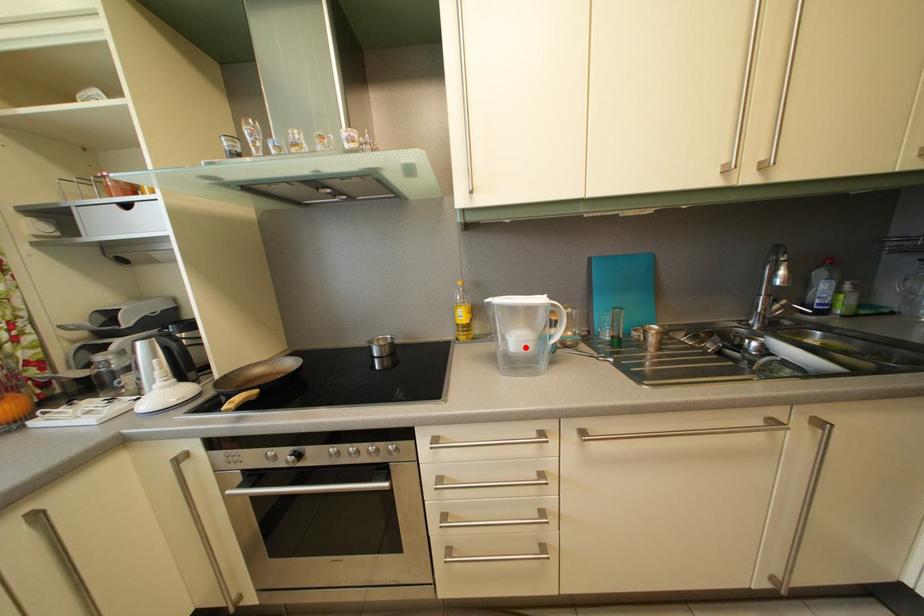
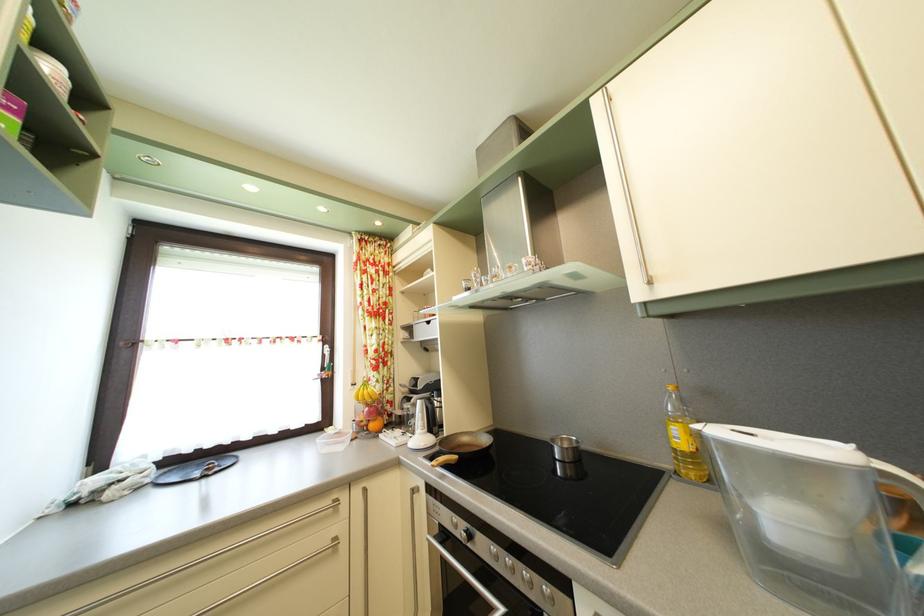
Locate, in the second image, the point that corresponds to the highlighted location in the first image.

(793, 528)